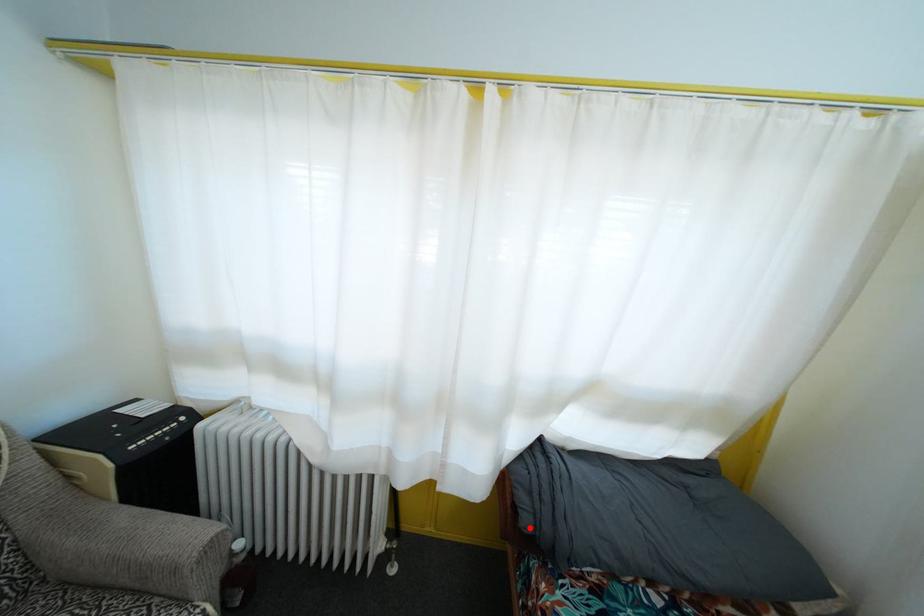
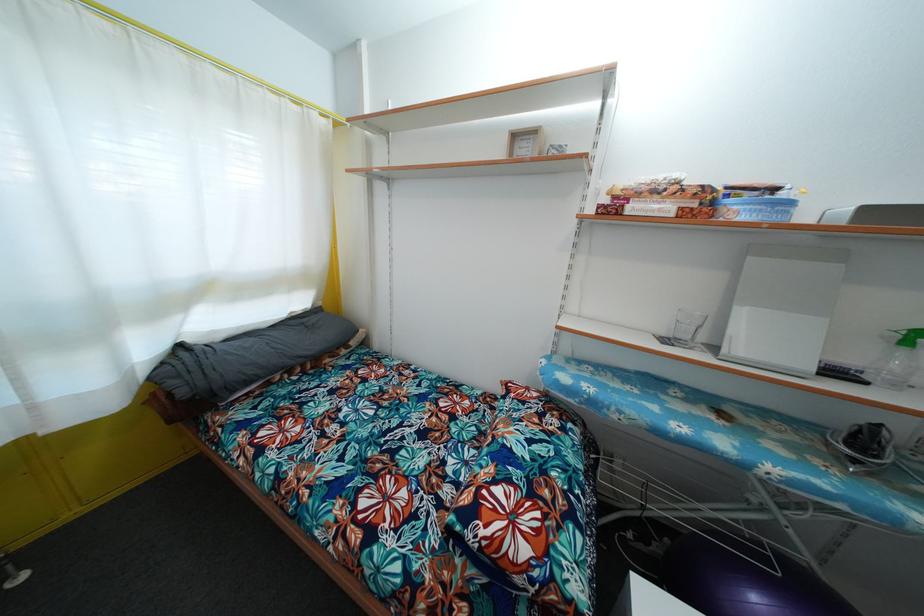
Question: I am providing you with two images of the same scene from different viewpoints. Image1 has a red point marked. In image2, the corresponding 3D location appears at what relative position? Reply with the corresponding letter.

Choices:
 (A) Closer
 (B) Farther

Answer: (A)